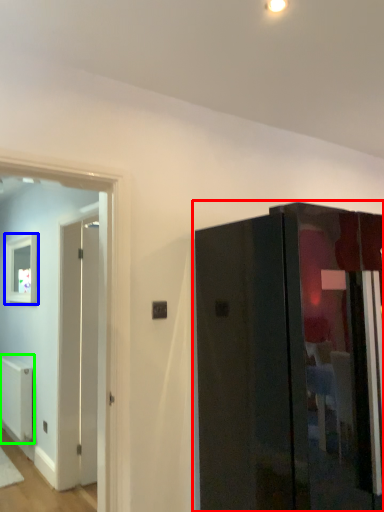
Question: Estimate the real-world distances between objects in this image. Which object is closer to door (highlighted by a red box), picture frame (highlighted by a blue box) or radiator (highlighted by a green box)?

Choices:
 (A) picture frame
 (B) radiator

Answer: (A)